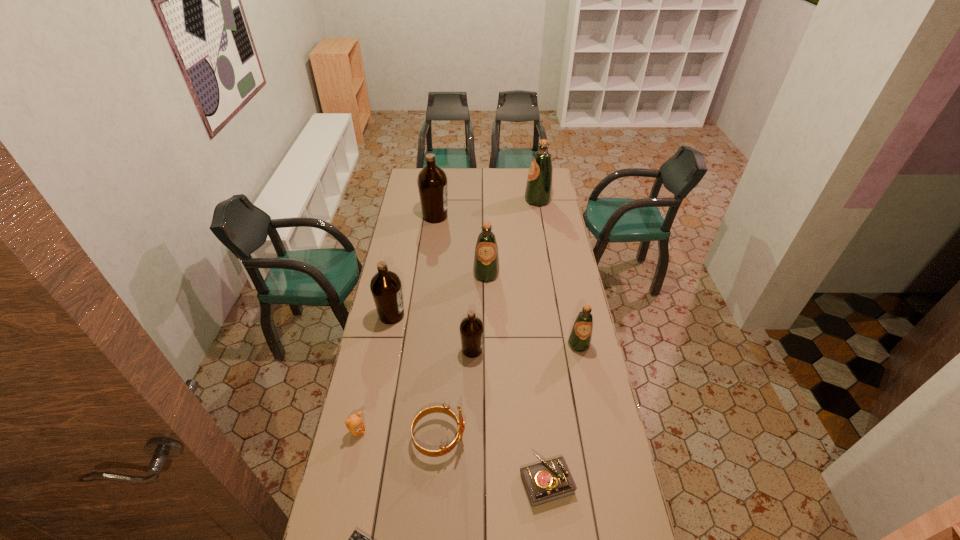
At what (x,y) coordinates should I click in order to perform the action: click on the smallest brown olive oil. Please return your answer as a coordinate pair (x, y). Looking at the image, I should click on (471, 328).

Where is `red tiara`? The width and height of the screenshot is (960, 540). red tiara is located at coordinates click(433, 409).

I want to click on teddy bear, so click(354, 423).

This screenshot has height=540, width=960. I want to click on the eighth tallest object, so click(354, 423).

The height and width of the screenshot is (540, 960). I want to click on the ninth tallest object, so click(x=547, y=481).

The image size is (960, 540). Find the location of `vacant space situated 0.340m on the front-facing side of the farthest green olive oil`. vacant space situated 0.340m on the front-facing side of the farthest green olive oil is located at coordinates (467, 200).

Where is `free location located 0.210m on the front-facing side of the farthest green olive oil`? free location located 0.210m on the front-facing side of the farthest green olive oil is located at coordinates (489, 200).

At what (x,y) coordinates should I click in order to perform the action: click on free space located on the front-facing side of the farthest green olive oil. Please return your answer as a coordinate pair (x, y). Looking at the image, I should click on (486, 200).

Find the location of a particular element. vacant space located on the label of the biggest brown olive oil is located at coordinates (491, 217).

Identify the location of free location located on the front-facing side of the second smallest green olive oil. (487, 332).